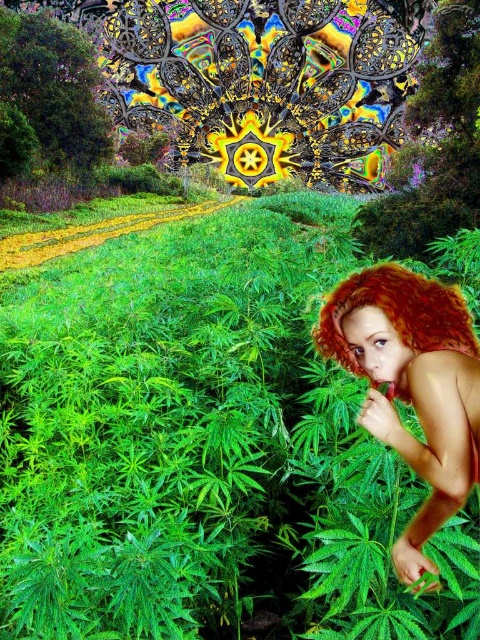
Is point (165, 336) positioned before point (360, 346)?

No.

Is green leafy grass at center taller than shiny red hair at right?

Indeed, green leafy grass at center has a greater height compared to shiny red hair at right.

Who is more forward, (124, 342) or (376, 275)?

Positioned in front is point (376, 275).

Where is `green leafy grass at center`? green leafy grass at center is located at coordinates (204, 445).

Can you confirm if shiny red hair at right is taller than vibrant red hair at right?

Indeed, shiny red hair at right has a greater height compared to vibrant red hair at right.

Who is positioned more to the right, shiny red hair at right or vibrant red hair at right?

vibrant red hair at right is more to the right.

What do you see at coordinates (411, 385) in the screenshot?
I see `shiny red hair at right` at bounding box center [411, 385].

Identify the location of shiny red hair at right. (411, 385).

Does green leafy grass at center have a lesser height compared to vibrant red hair at right?

No, green leafy grass at center is not shorter than vibrant red hair at right.

In the scene shown: Who is more forward, (228, 220) or (342, 291)?

Point (342, 291)

Find the location of `green leafy grass at center`. green leafy grass at center is located at coordinates (204, 445).